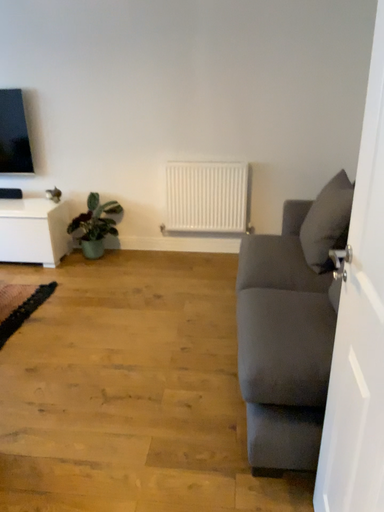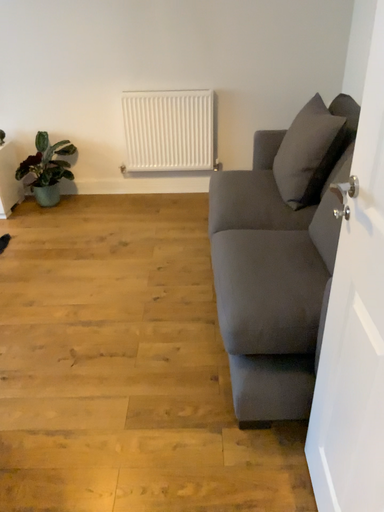
Question: Which way did the camera rotate in the video?

Choices:
 (A) rotated downward
 (B) rotated upward

Answer: (A)